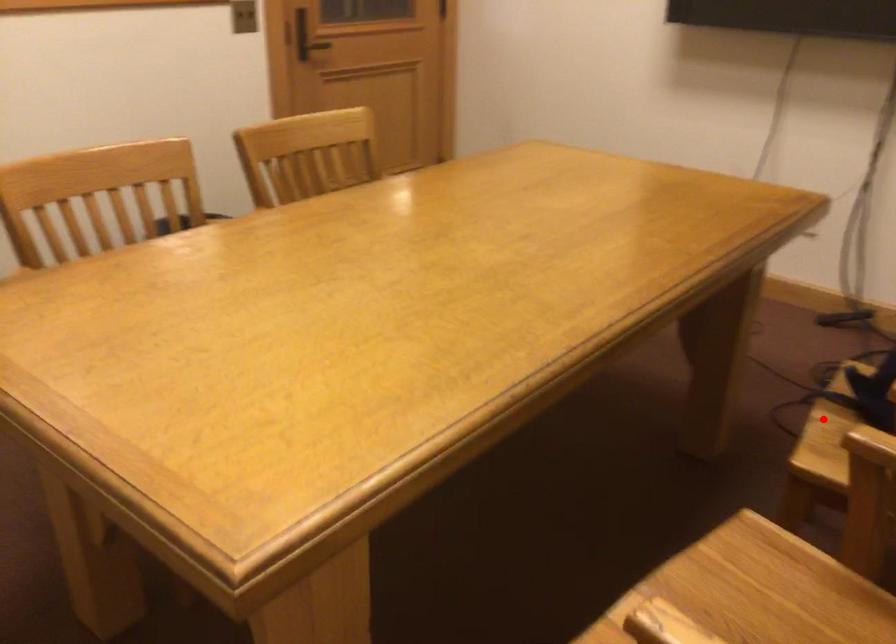
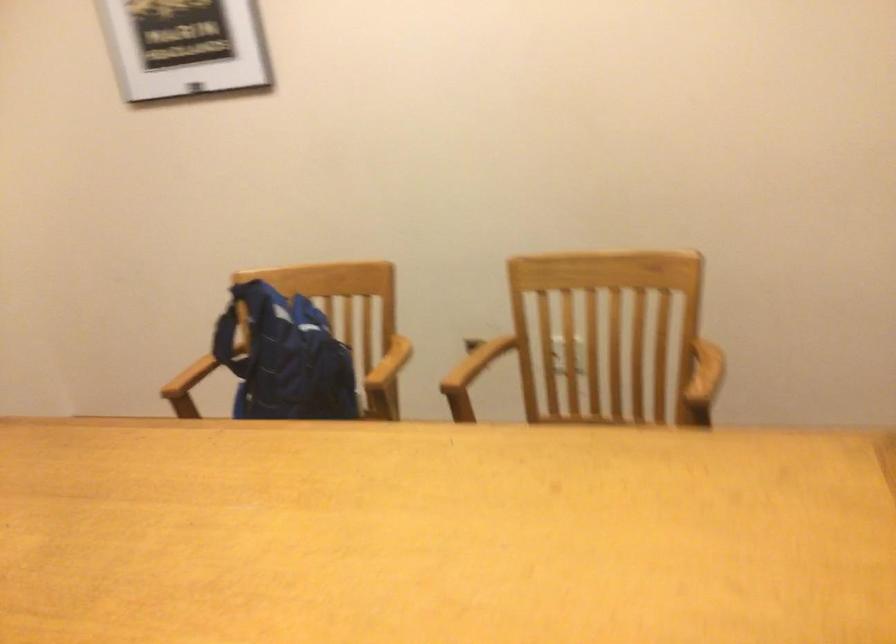
Question: I am providing you with two images of the same scene from different viewpoints. A red point is marked on the first image. At the location where the point appears in image 1, is it still visible in image 2?

Choices:
 (A) Yes
 (B) No

Answer: (B)